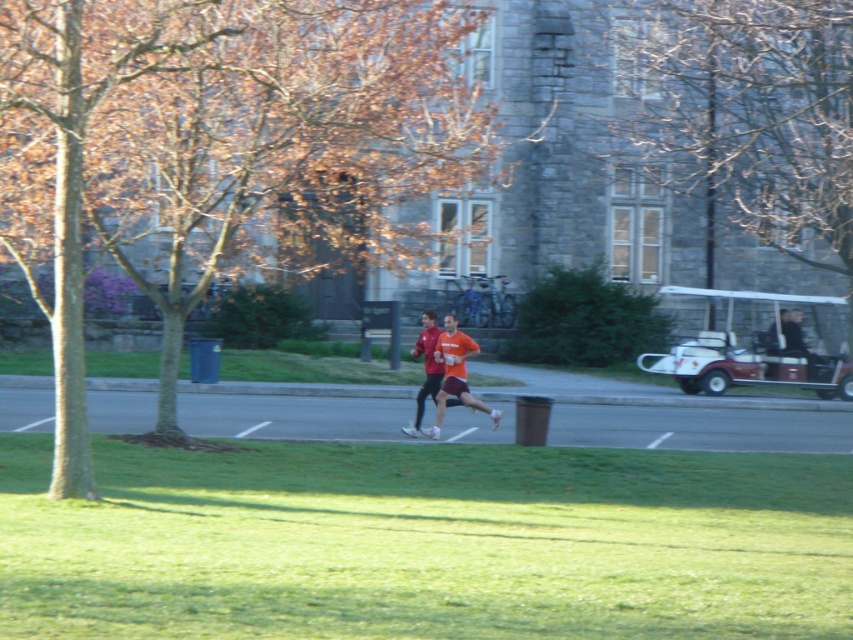
Does orange matte running shirt at center appear on the right side of matte red shirt at center?

Yes, orange matte running shirt at center is to the right of matte red shirt at center.

From the picture: Can you confirm if orange matte running shirt at center is positioned to the left of matte red shirt at center?

In fact, orange matte running shirt at center is to the right of matte red shirt at center.

The height and width of the screenshot is (640, 853). Identify the location of orange matte running shirt at center. (456, 374).

Between point (521, 524) and point (698, 294), which one is positioned in front?

Point (521, 524)

Which of these two, green grassy field at lower center or maroon plastic golf cart at right, stands shorter?

maroon plastic golf cart at right

Image resolution: width=853 pixels, height=640 pixels. I want to click on green grassy field at lower center, so coord(426,541).

Is point (421, 131) farther from viewer compared to point (454, 340)?

That is True.

Is brown leafy tree at center wider than orange matte running shirt at center?

Yes, brown leafy tree at center is wider than orange matte running shirt at center.

I want to click on brown leafy tree at center, so pyautogui.click(x=225, y=150).

Find the location of a particular element. Image resolution: width=853 pixels, height=640 pixels. brown leafy tree at center is located at coordinates (225, 150).